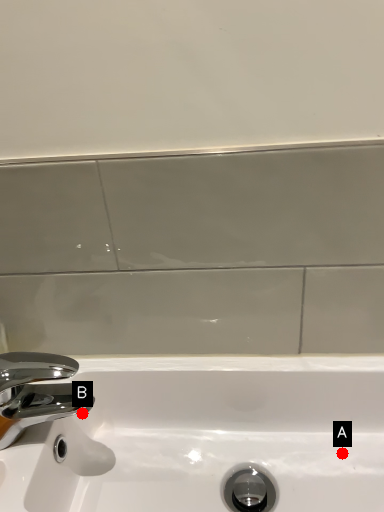
Question: Two points are circled on the image, labeled by A and B beside each circle. Which point appears closest to the camera in this image?

Choices:
 (A) A is closer
 (B) B is closer

Answer: (A)